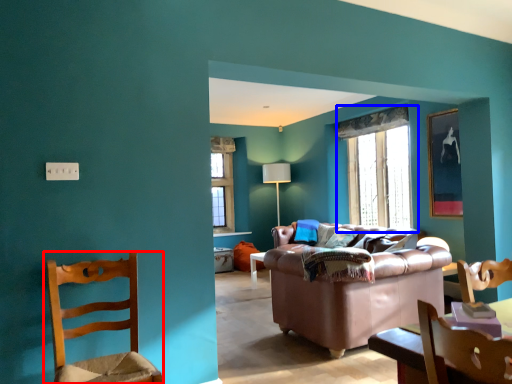
Question: Which object is further to the camera taking this photo, chair (highlighted by a red box) or window (highlighted by a blue box)?

Choices:
 (A) chair
 (B) window

Answer: (B)